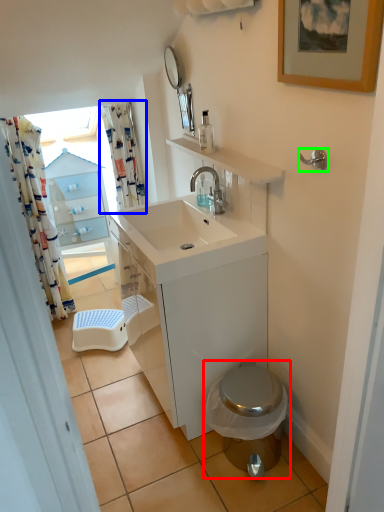
Question: Considering the real-world distances, which object is closest to toilet (highlighted by a red box)? shower curtain (highlighted by a blue box) or towel bar (highlighted by a green box).

Choices:
 (A) shower curtain
 (B) towel bar

Answer: (B)